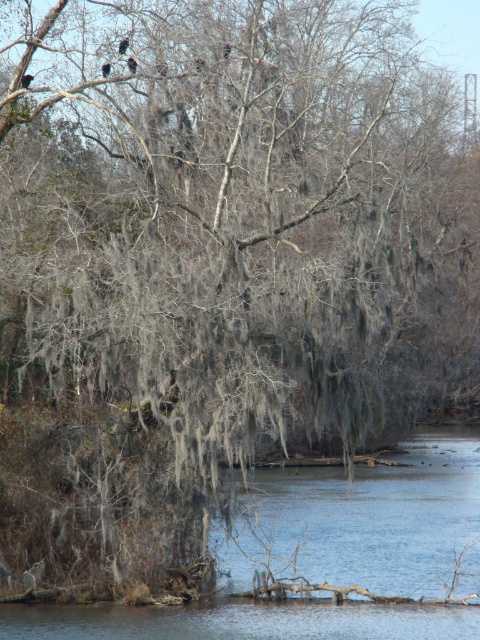
Question: Where is dark gray feathers at upper center located in relation to dark brown feathers at upper center in the image?

Choices:
 (A) left
 (B) right

Answer: (B)

Question: Does black glossy bird at upper center lie behind dark gray feathers at upper center?

Choices:
 (A) yes
 (B) no

Answer: (A)

Question: Estimate the real-world distances between objects in this image. Which object is closer to the dark brown feathers at upper center?

Choices:
 (A) black matte bird at upper center
 (B) dark gray feathers at upper center
 (C) black glossy bird at upper center

Answer: (A)

Question: Which is nearer to the black matte bird at upper center?

Choices:
 (A) black glossy bird at upper center
 (B) dark gray feathers at upper center
 (C) dark brown feathers at upper center

Answer: (B)

Question: Which of these objects is positioned farthest from the black matte bird at upper center?

Choices:
 (A) black glossy bird at upper center
 (B) dark gray feathers at upper center
 (C) dark brown feathers at upper center

Answer: (A)

Question: Is black glossy bird at upper center above black matte bird at upper center?

Choices:
 (A) no
 (B) yes

Answer: (A)